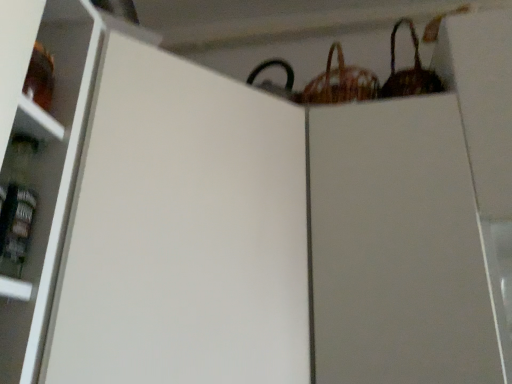
Find the location of a particular element. The image size is (512, 384). white matte cabinet at center is located at coordinates (183, 233).

Describe the element at coordinates (340, 83) in the screenshot. I see `woven brown basket at upper right, the 2th basket viewed from the right` at that location.

Locate an element on the screen. Image resolution: width=512 pixels, height=384 pixels. white matte cabinet at center is located at coordinates (183, 233).

The image size is (512, 384). What are the coordinates of `basket lying on the left of woven brown basket at upper right, the 2th basket from the left` in the screenshot? It's located at (340, 83).

From the image's perspective, is woven brown basket at upper right, the 2th basket viewed from the right, located above woven brown basket at upper right, the 2th basket from the left?

Incorrect, from the image's perspective, woven brown basket at upper right, the 2th basket viewed from the right, is lower than woven brown basket at upper right, the 2th basket from the left.

Is point (324, 82) closer or farther from the camera than point (389, 79)?

Point (324, 82) is closer to the camera than point (389, 79).

Considering the relative sizes of woven brown basket at upper right, the 2th basket viewed from the right, and white matte cabinet at center in the image provided, is woven brown basket at upper right, the 2th basket viewed from the right, shorter than white matte cabinet at center?

Correct, woven brown basket at upper right, the 2th basket viewed from the right, is not as tall as white matte cabinet at center.

Which basket is the 1st one when counting from the right side of the white matte cabinet at center? Please provide its 2D coordinates.

[(340, 83)]

In the scene shown: From the image's perspective, is woven brown basket at upper right, the 2th basket viewed from the right, above or below white matte cabinet at center?

From the image's perspective, woven brown basket at upper right, the 2th basket viewed from the right, appears above white matte cabinet at center.

Which is more to the left, woven brown basket at upper right, the 2th basket viewed from the right, or white matte cabinet at center?

white matte cabinet at center.

From the image's perspective, which object appears higher, woven brown basket at upper right, arranged as the 1th basket when viewed from the right, or woven brown basket at upper right, the first basket from the left?

woven brown basket at upper right, arranged as the 1th basket when viewed from the right, appears higher in the image.

From a real-world perspective, which object rests below the other?

woven brown basket at upper right, arranged as the 1th basket when viewed from the right, from a real-world perspective.

At what (x,y) coordinates should I click in order to perform the action: click on basket that is under the woven brown basket at upper right, the first basket from the left (from a real-world perspective). Please return your answer as a coordinate pair (x, y). The image size is (512, 384). Looking at the image, I should click on (409, 71).

Between woven brown basket at upper right, arranged as the 1th basket when viewed from the right, and woven brown basket at upper right, the 2th basket viewed from the right, which one has more height?

With more height is woven brown basket at upper right, the 2th basket viewed from the right.

At what (x,y) coordinates should I click in order to perform the action: click on screen door on the left of woven brown basket at upper right, arranged as the 1th basket when viewed from the right. Please return your answer as a coordinate pair (x, y). Looking at the image, I should click on (183, 233).

In terms of size, does white matte cabinet at center appear bigger or smaller than woven brown basket at upper right, arranged as the 1th basket when viewed from the right?

Clearly, white matte cabinet at center is larger in size than woven brown basket at upper right, arranged as the 1th basket when viewed from the right.

Considering their positions, is white matte cabinet at center located in front of or behind woven brown basket at upper right, arranged as the 1th basket when viewed from the right?

white matte cabinet at center is positioned closer to the viewer than woven brown basket at upper right, arranged as the 1th basket when viewed from the right.

Can you confirm if white matte cabinet at center is positioned to the left of woven brown basket at upper right, the 2th basket from the left?

Yes.

Could you tell me if white matte cabinet at center is facing woven brown basket at upper right, the first basket from the left?

No, white matte cabinet at center is not oriented towards woven brown basket at upper right, the first basket from the left.

Is woven brown basket at upper right, the first basket from the left, located within white matte cabinet at center?

No, woven brown basket at upper right, the first basket from the left, is not surrounded by white matte cabinet at center.

Considering the sizes of white matte cabinet at center and woven brown basket at upper right, the first basket from the left, in the image, is white matte cabinet at center wider or thinner than woven brown basket at upper right, the first basket from the left,?

white matte cabinet at center is wider than woven brown basket at upper right, the first basket from the left.

Is point (301, 203) farther from camera compared to point (368, 93)?

No, it is in front of (368, 93).

Based on their positions, is woven brown basket at upper right, arranged as the 1th basket when viewed from the right, located to the left or right of white matte cabinet at center?

In the image, woven brown basket at upper right, arranged as the 1th basket when viewed from the right, appears on the right side of white matte cabinet at center.

Which object is further away from the camera, woven brown basket at upper right, the 2th basket from the left, or white matte cabinet at center?

woven brown basket at upper right, the 2th basket from the left, is further from the camera.

From a real-world perspective, is woven brown basket at upper right, arranged as the 1th basket when viewed from the right, physically located above or below white matte cabinet at center?

woven brown basket at upper right, arranged as the 1th basket when viewed from the right, is situated higher than white matte cabinet at center in the real world.

Is woven brown basket at upper right, arranged as the 1th basket when viewed from the right, looking in the opposite direction of white matte cabinet at center?

woven brown basket at upper right, arranged as the 1th basket when viewed from the right, does not have its back to white matte cabinet at center.

Where is `basket below the woven brown basket at upper right, the first basket from the left (from a real-world perspective)`? The height and width of the screenshot is (384, 512). basket below the woven brown basket at upper right, the first basket from the left (from a real-world perspective) is located at coordinates (409, 71).

The height and width of the screenshot is (384, 512). I want to click on screen door below the woven brown basket at upper right, the 2th basket viewed from the right (from the image's perspective), so (x=183, y=233).

When comparing their distances from woven brown basket at upper right, the first basket from the left, does white matte cabinet at center or woven brown basket at upper right, arranged as the 1th basket when viewed from the right, seem closer?

Answer: woven brown basket at upper right, arranged as the 1th basket when viewed from the right, is closer to woven brown basket at upper right, the first basket from the left.

Considering their positions, is woven brown basket at upper right, the 2th basket viewed from the right, positioned further to white matte cabinet at center than woven brown basket at upper right, the 2th basket from the left?

Among the two, woven brown basket at upper right, the 2th basket from the left, is located further to white matte cabinet at center.

Which object lies nearer to the anchor point white matte cabinet at center, woven brown basket at upper right, arranged as the 1th basket when viewed from the right, or woven brown basket at upper right, the first basket from the left?

Among the two, woven brown basket at upper right, the first basket from the left, is located nearer to white matte cabinet at center.

Which object lies nearer to the anchor point woven brown basket at upper right, the 2th basket from the left, woven brown basket at upper right, the 2th basket viewed from the right, or white matte cabinet at center?

woven brown basket at upper right, the 2th basket viewed from the right, is positioned closer to the anchor woven brown basket at upper right, the 2th basket from the left.

Based on their spatial positions, is white matte cabinet at center or woven brown basket at upper right, the first basket from the left, closer to woven brown basket at upper right, arranged as the 1th basket when viewed from the right?

woven brown basket at upper right, the first basket from the left.

Which object lies nearer to the anchor point woven brown basket at upper right, the 2th basket viewed from the right, woven brown basket at upper right, the 2th basket from the left, or white matte cabinet at center?

Among the two, woven brown basket at upper right, the 2th basket from the left, is located nearer to woven brown basket at upper right, the 2th basket viewed from the right.

In order to click on basket between white matte cabinet at center and woven brown basket at upper right, the 2th basket viewed from the right, from front to back in this screenshot , I will do `click(409, 71)`.